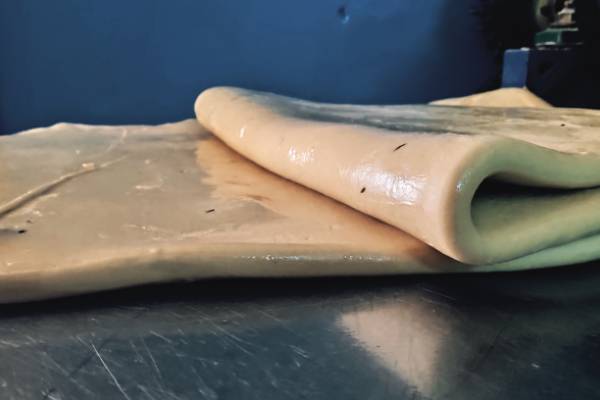
Locate an element on the screen. The image size is (600, 400). reflection of item on counter is located at coordinates (411, 340).